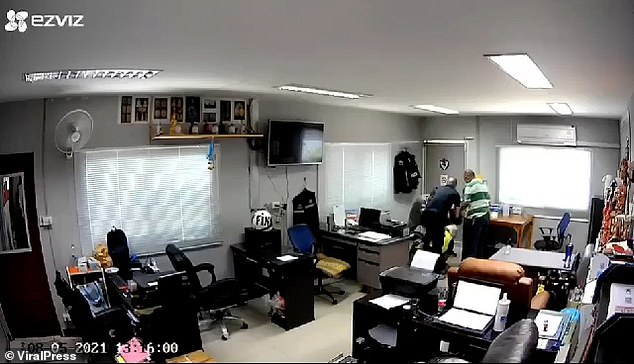
Find the location of a particular element. This screenshot has width=634, height=364. window is located at coordinates (133, 189).